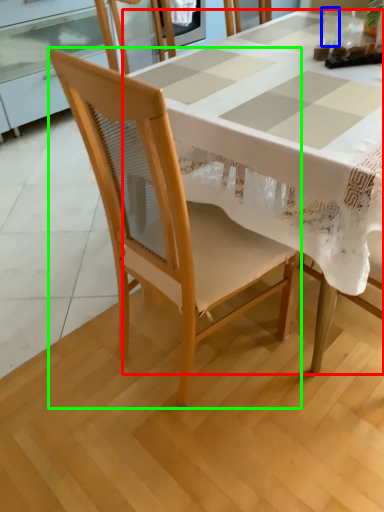
Question: Based on their relative distances, which object is farther from table (highlighted by a red box)? Choose from tableware (highlighted by a blue box) and chair (highlighted by a green box).

Choices:
 (A) tableware
 (B) chair

Answer: (A)